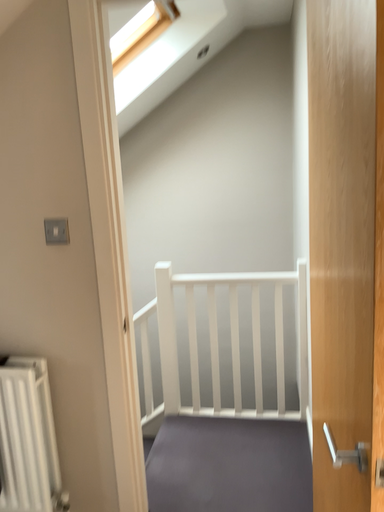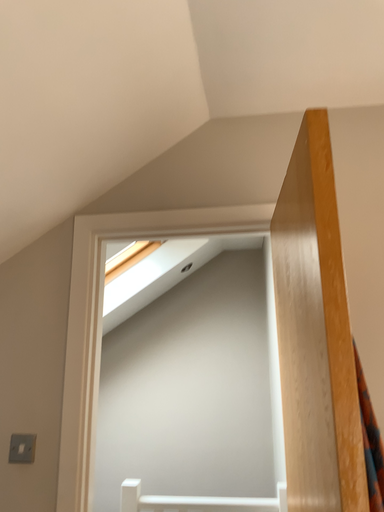
Question: Which way did the camera rotate in the video?

Choices:
 (A) rotated upward
 (B) rotated downward

Answer: (A)